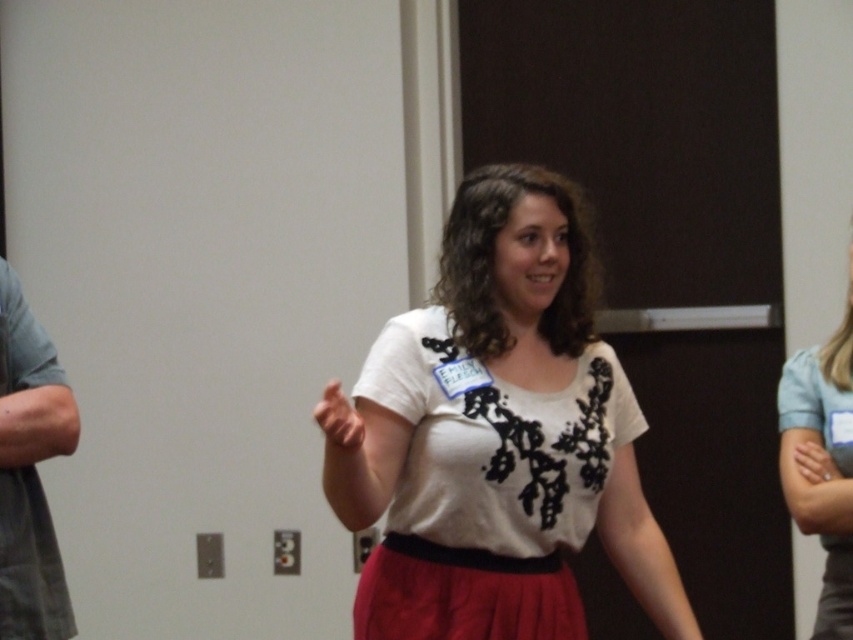
Question: Considering the relative positions of white matte shirt at center and gray fabric shirt at left in the image provided, where is white matte shirt at center located with respect to gray fabric shirt at left?

Choices:
 (A) above
 (B) below

Answer: (A)

Question: Which point is closer to the camera?

Choices:
 (A) matte white blouse at center
 (B) white matte shirt at center

Answer: (B)

Question: Which point is farther to the camera?

Choices:
 (A) gray fabric shirt at left
 (B) white matte shirt at center

Answer: (A)

Question: Is white matte shirt at center below gray fabric shirt at left?

Choices:
 (A) no
 (B) yes

Answer: (A)

Question: Which point is closer to the camera?

Choices:
 (A) (442, 321)
 (B) (833, 588)

Answer: (A)

Question: Does gray fabric shirt at left have a greater width compared to matte white blouse at center?

Choices:
 (A) yes
 (B) no

Answer: (A)